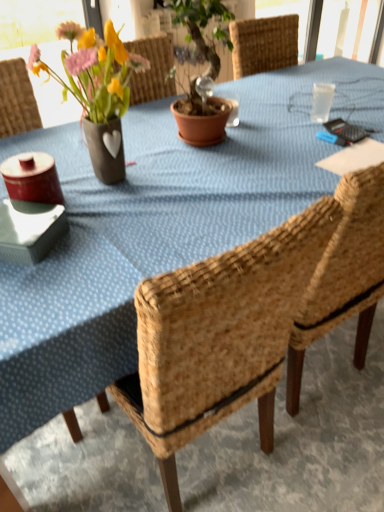
Question: Is matte ceramic vase at upper left shorter than woven wood chair at center?

Choices:
 (A) no
 (B) yes

Answer: (B)

Question: Can woven wood chair at center be found inside matte ceramic vase at upper left?

Choices:
 (A) no
 (B) yes

Answer: (A)

Question: Does matte ceramic vase at upper left have a smaller size compared to woven wood chair at center?

Choices:
 (A) yes
 (B) no

Answer: (A)

Question: Does matte ceramic vase at upper left turn towards woven wood chair at center?

Choices:
 (A) no
 (B) yes

Answer: (B)

Question: From a real-world perspective, is matte ceramic vase at upper left positioned over woven wood chair at center based on gravity?

Choices:
 (A) no
 (B) yes

Answer: (B)

Question: Does matte ceramic vase at upper left come behind woven wood chair at center?

Choices:
 (A) yes
 (B) no

Answer: (A)

Question: Considering the relative sizes of woven wood chair at center and matte ceramic vase at upper left in the image provided, is woven wood chair at center bigger than matte ceramic vase at upper left?

Choices:
 (A) no
 (B) yes

Answer: (B)

Question: From a real-world perspective, does woven wood chair at center stand above matte ceramic vase at upper left?

Choices:
 (A) no
 (B) yes

Answer: (A)

Question: Is woven wood chair at center shorter than matte ceramic vase at upper left?

Choices:
 (A) yes
 (B) no

Answer: (B)

Question: Is there a large distance between woven wood chair at center and matte ceramic vase at upper left?

Choices:
 (A) no
 (B) yes

Answer: (A)

Question: Can you confirm if woven wood chair at center is positioned to the right of matte ceramic vase at upper left?

Choices:
 (A) yes
 (B) no

Answer: (A)

Question: Does woven wood chair at center turn towards matte ceramic vase at upper left?

Choices:
 (A) yes
 (B) no

Answer: (A)

Question: Is woven wood chair at center inside or outside of matte ceramic vase at upper left?

Choices:
 (A) outside
 (B) inside

Answer: (A)